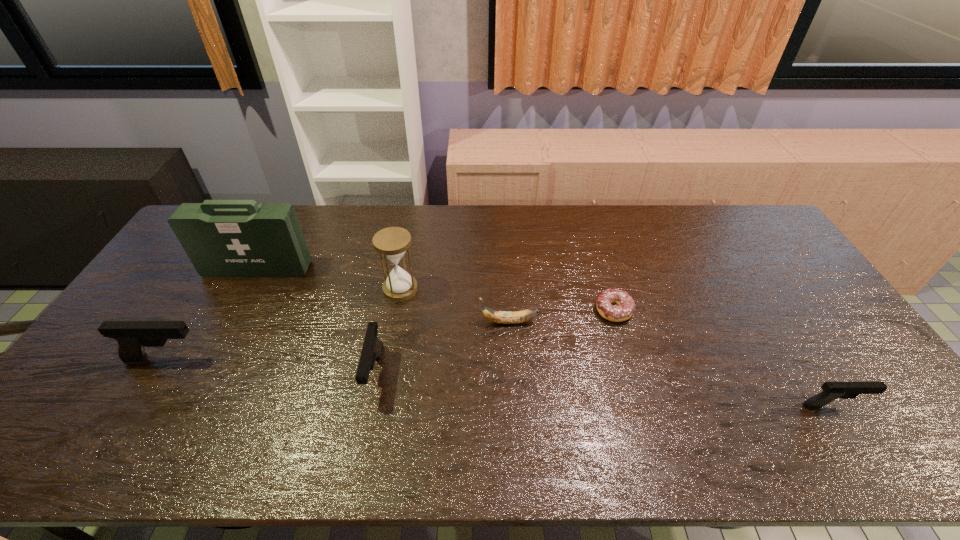
I want to click on vacant area that lies between the shortest pistol and the tallest object, so click(x=545, y=338).

The height and width of the screenshot is (540, 960). What are the coordinates of `vacant space that is in between the second tallest object and the fourth shortest object` in the screenshot? It's located at (388, 331).

You are a GUI agent. You are given a task and a screenshot of the screen. Output one action in this format:
    pyautogui.click(x=<x>, y=<y>)
    Task: Click on the free space between the tallest object and the rightmost object
    The height and width of the screenshot is (540, 960).
    Given the screenshot: What is the action you would take?
    pyautogui.click(x=545, y=338)

The width and height of the screenshot is (960, 540). What are the coordinates of `empty space between the tallest pistol and the shortest object` in the screenshot? It's located at (390, 334).

At what (x,y) coordinates should I click in order to perform the action: click on empty space between the fourth shortest object and the hourglass. Please return your answer as a coordinate pair (x, y). The image size is (960, 540). Looking at the image, I should click on (388, 331).

Image resolution: width=960 pixels, height=540 pixels. What are the coordinates of `unoccupied area between the second object from right to left and the third object from right to left` in the screenshot? It's located at (562, 316).

In order to click on free space that is in between the shortest object and the second tallest object in this screenshot , I will do `click(507, 300)`.

Where is `free spot between the second tallest object and the tallest object`? This screenshot has height=540, width=960. free spot between the second tallest object and the tallest object is located at coordinates pyautogui.click(x=329, y=279).

Find the location of a particular element. This screenshot has width=960, height=540. object that is the sixth closest to the banana is located at coordinates (132, 337).

Where is `object that is the fourth closest one to the second tallest pistol`? This screenshot has width=960, height=540. object that is the fourth closest one to the second tallest pistol is located at coordinates (132, 337).